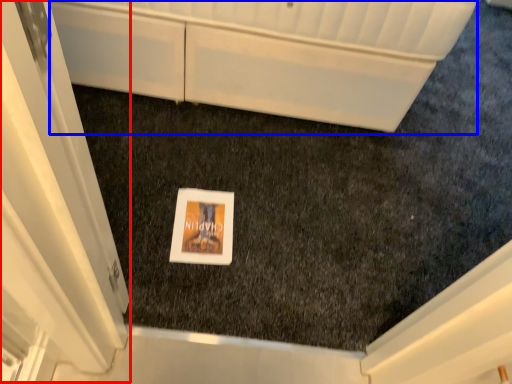
Question: Which point is closer to the camera, screen door (highlighted by a red box) or cabinetry (highlighted by a blue box)?

Choices:
 (A) screen door
 (B) cabinetry

Answer: (A)